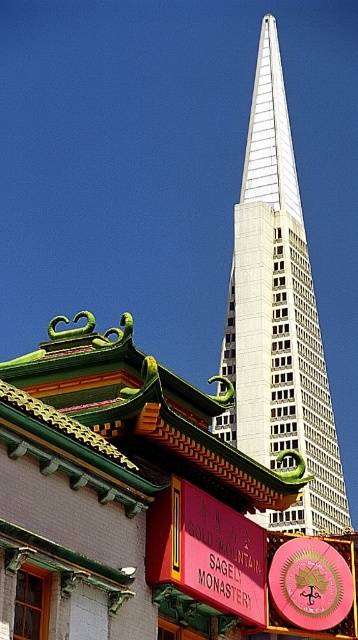
You are a drone operator who needs to deliver a package from the white glass skyscraper at center to the red matte sign at center. The drone has a maximum flight range of 80 meters. Can the drone complete the delivery without recharging?

The white glass skyscraper at center is 84.67 meters away from the red matte sign at center. Since the drone can only fly 80 meters before needing to recharge, it cannot complete the delivery without recharging.

You are a photographer standing in front of the traditional Chinese building. You want to take a photo that includes both the white glass skyscraper at center and the red matte sign at center. Based on their positions, will the skyscraper block the view of the sign in your photo?

The white glass skyscraper at center is positioned over the red matte sign at center, so the skyscraper will block the view of the sign in the photo.

You are a tourist standing in front of the traditional Chinese building and want to check the time. You see the red matte sign at center and the pink glossy clock at center. Which object should you look at to find the current time?

The pink glossy clock at center can be used to check the current time, as it is a clock, while the red matte sign at center is likely a signboard with information about the building.